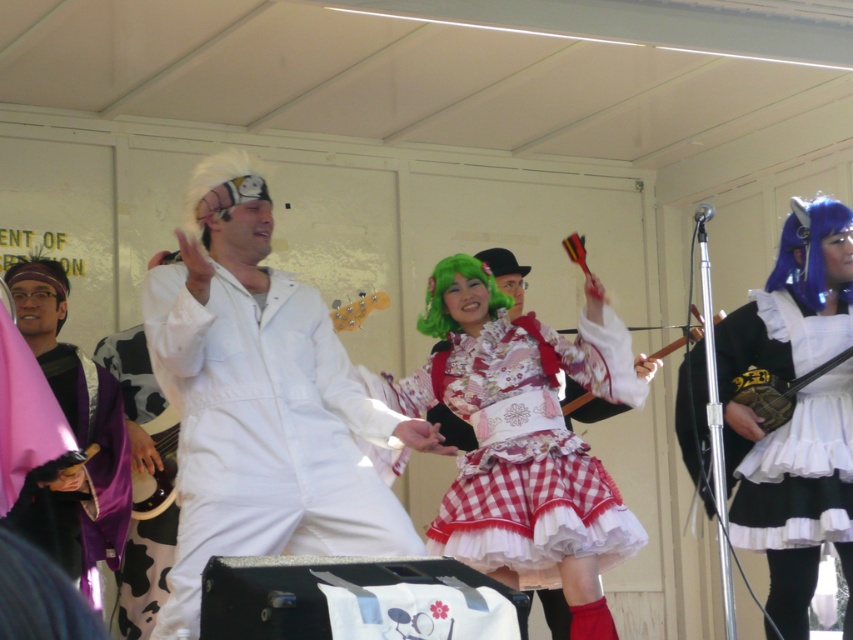
Question: Among these points, which one is nearest to the camera?

Choices:
 (A) (585, 358)
 (B) (68, 532)

Answer: (B)

Question: Considering the real-world distances, which object is closest to the purple velvet robe at left?

Choices:
 (A) white matte jumpsuit at center
 (B) gingham fabric dress at center
 (C) black satin dress at right

Answer: (A)

Question: Does white matte jumpsuit at center have a greater width compared to black satin dress at right?

Choices:
 (A) yes
 (B) no

Answer: (A)

Question: Which object is farther from the camera taking this photo?

Choices:
 (A) purple velvet robe at left
 (B) white matte jumpsuit at center
 (C) gingham fabric dress at center
 (D) black satin dress at right

Answer: (A)

Question: Is white matte jumpsuit at center positioned in front of black satin dress at right?

Choices:
 (A) yes
 (B) no

Answer: (A)

Question: Can you confirm if gingham fabric dress at center is positioned above purple velvet robe at left?

Choices:
 (A) yes
 (B) no

Answer: (B)